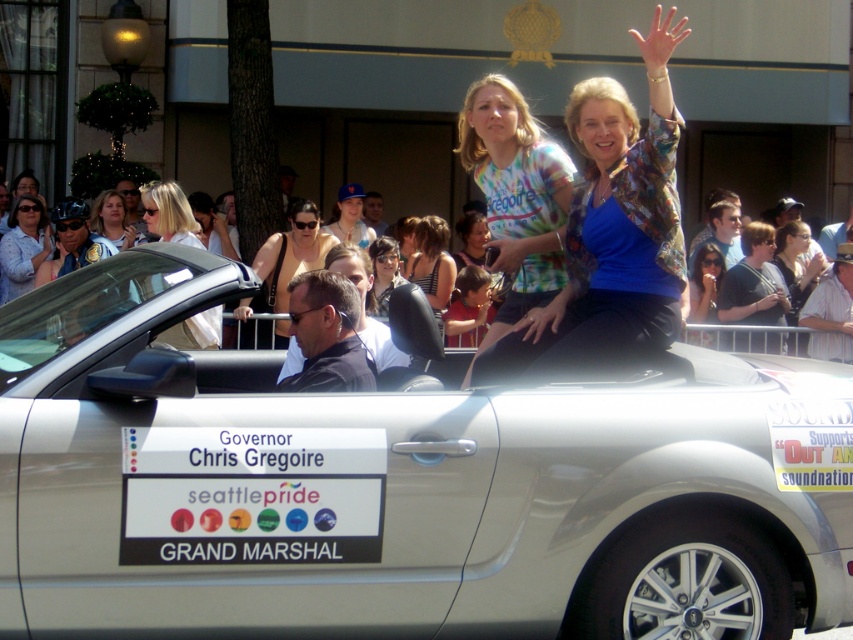
Question: Is matte black convertible at center behind white matte sunglasses at upper left?

Choices:
 (A) yes
 (B) no

Answer: (A)

Question: Which object is closer to the camera taking this photo?

Choices:
 (A) silver metallic convertible at center
 (B) multicolored printed shirt at center

Answer: (B)

Question: Among these objects, which one is nearest to the camera?

Choices:
 (A) striped fabric tank top at center
 (B) matte black sunglasses at upper center
 (C) denim jacket at upper left

Answer: (A)

Question: Is matte black convertible at center bigger than matte black jacket at center?

Choices:
 (A) no
 (B) yes

Answer: (B)

Question: Which point is closer to the camera taking this photo?

Choices:
 (A) (552, 163)
 (B) (345, 214)
 (C) (91, 224)
 (D) (445, 252)

Answer: (A)

Question: Is matte black convertible at center above white matte sunglasses at upper left?

Choices:
 (A) yes
 (B) no

Answer: (B)